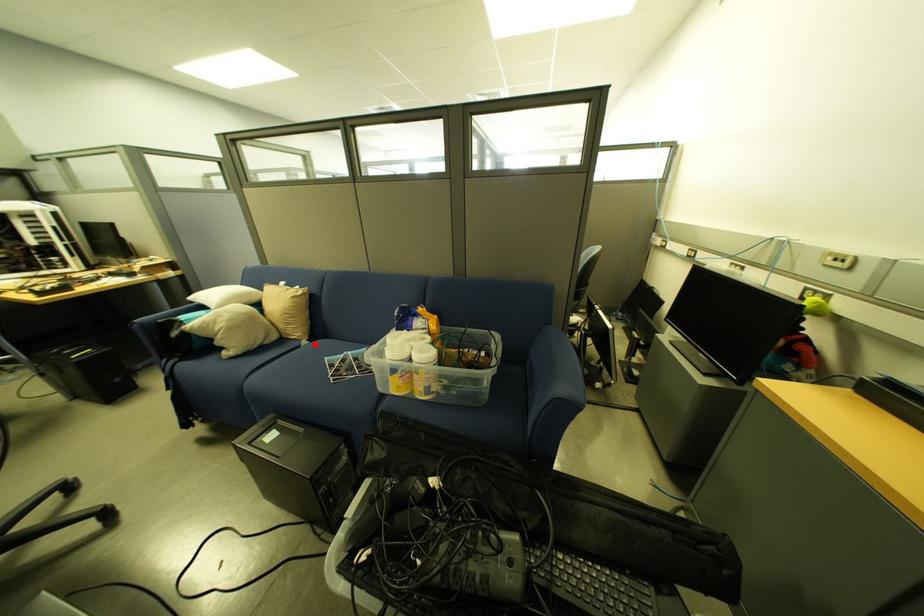
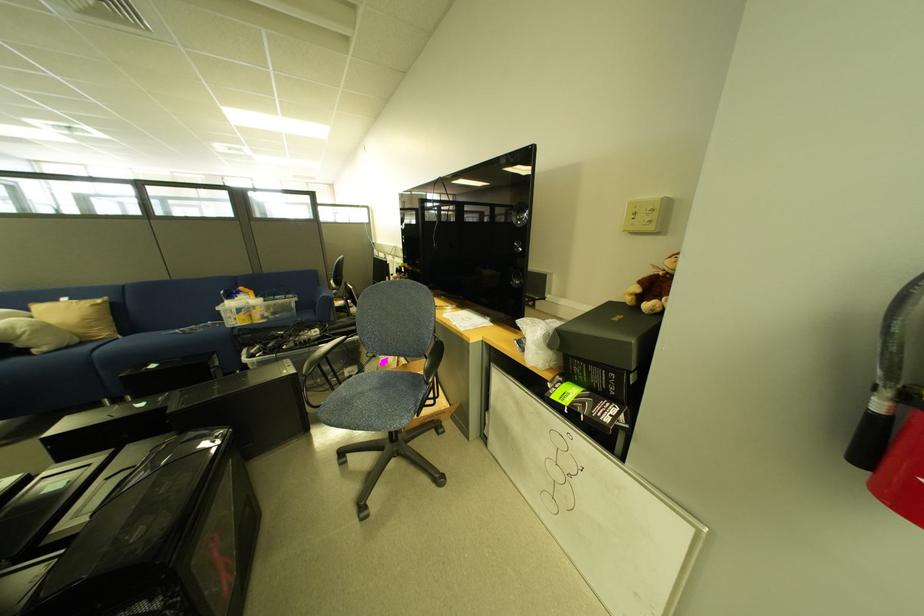
The point at the highlighted location is marked in the first image. Where is the corresponding point in the second image?

(130, 339)